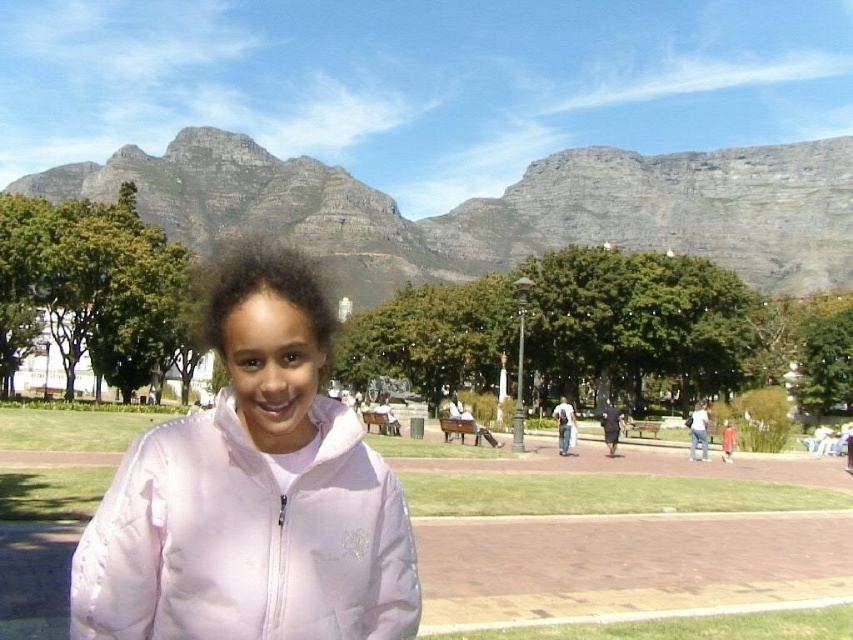
Question: Which point is farther to the camera?

Choices:
 (A) pink quilted jacket at center
 (B) rocky gray mountain at upper center

Answer: (B)

Question: Does pink quilted jacket at center come behind rocky gray mountain at upper center?

Choices:
 (A) no
 (B) yes

Answer: (A)

Question: Which point is farther to the camera?

Choices:
 (A) pink quilted jacket at center
 (B) rocky gray mountain at upper center

Answer: (B)

Question: Is pink quilted jacket at center further to the viewer compared to rocky gray mountain at upper center?

Choices:
 (A) no
 (B) yes

Answer: (A)

Question: Is pink quilted jacket at center to the right of rocky gray mountain at upper center from the viewer's perspective?

Choices:
 (A) no
 (B) yes

Answer: (A)